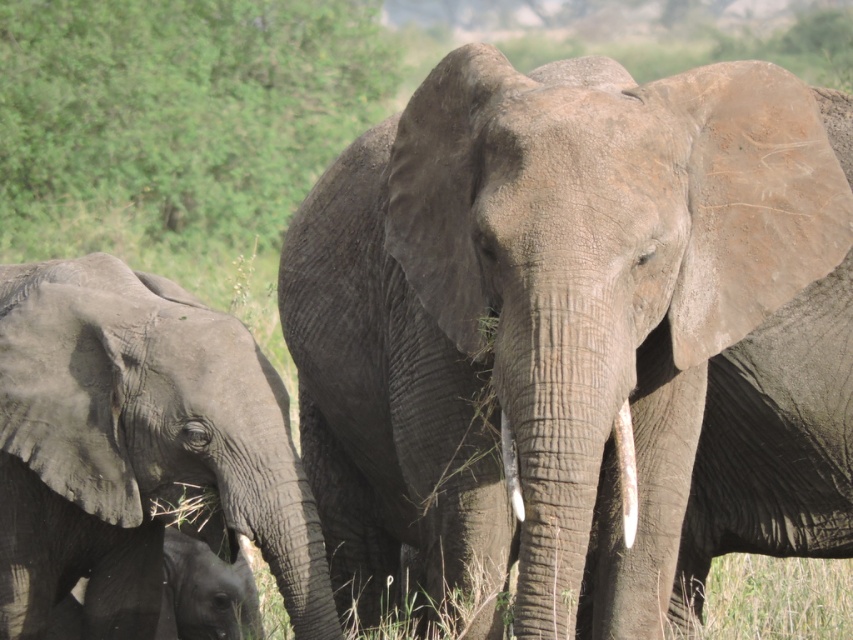
You are an elephant researcher observing two points marked on the elephants in the savanna. The points are labeled as point 1 at coordinates (x=294, y=472) and point 2 at (x=630, y=516). Based on their positions, which point is located behind the other?

Point 1 at coordinates (x=294, y=472) is behind point 2 at (x=630, y=516).

You are a wildlife photographer aiming to capture a closeup shot of the gray textured elephant at center and the white matte tusk at center. Since you want to focus on both subjects equally, which one should you adjust your camera focus on first considering their sizes?

The gray textured elephant at center is taller than the white matte tusk at center, so you should focus on the gray textured elephant at center first as it is larger in size.